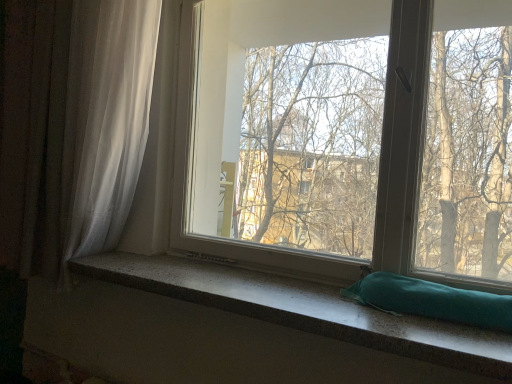
Question: In the image, is transparent glass window at center positioned in front of or behind granite-like teal pillow at lower center?

Choices:
 (A) behind
 (B) front

Answer: (A)

Question: Does point (185, 48) appear closer or farther from the camera than point (423, 347)?

Choices:
 (A) farther
 (B) closer

Answer: (A)

Question: Which object is the farthest from the granite-like teal pillow at lower center?

Choices:
 (A) white sheer curtain at left
 (B) teal fabric pillow at lower right
 (C) transparent glass window at center

Answer: (C)

Question: Which object is the closest to the transparent glass window at center?

Choices:
 (A) white sheer curtain at left
 (B) teal fabric pillow at lower right
 (C) granite-like teal pillow at lower center

Answer: (A)